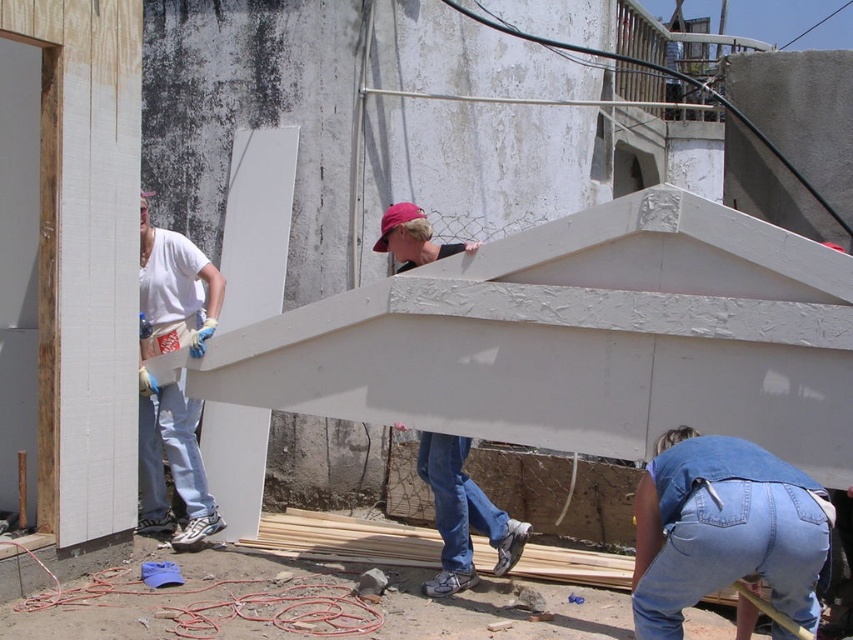
Which is in front, point (141, 330) or point (427, 433)?

Point (427, 433) is more forward.

Is point (138, 481) behind point (466, 499)?

Yes, it is behind point (466, 499).

Find the location of a particular element. white matte t-shirt at left is located at coordinates (171, 460).

Who is higher up, denim jeans at lower right or white matte t-shirt at left?

white matte t-shirt at left is above.

Does denim jeans at lower right have a smaller size compared to white matte t-shirt at left?

Yes, denim jeans at lower right is smaller than white matte t-shirt at left.

Does point (640, 529) come closer to viewer compared to point (169, 442)?

That is True.

Where is `denim jeans at lower right`? The image size is (853, 640). denim jeans at lower right is located at coordinates (723, 529).

Where is `denim jeans at lower right`? The height and width of the screenshot is (640, 853). denim jeans at lower right is located at coordinates (723, 529).

Is point (694, 465) farther from camera compared to point (503, 573)?

No.

What are the coordinates of `denim jeans at lower right` in the screenshot? It's located at (723, 529).